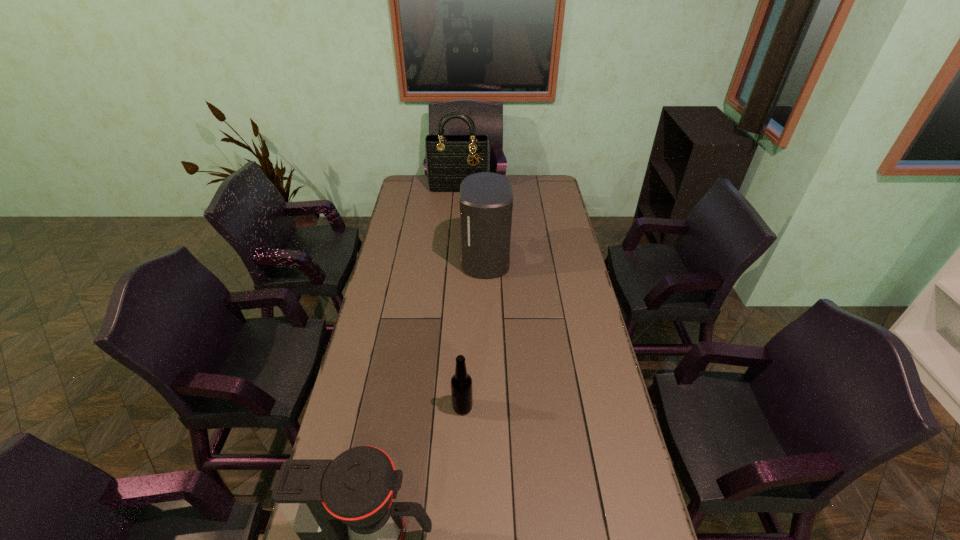
Identify the location of free point between the second farthest object and the beer bottle. The width and height of the screenshot is (960, 540). click(x=473, y=333).

Image resolution: width=960 pixels, height=540 pixels. Find the location of `free space that is in between the shortest object and the right coffee maker`. free space that is in between the shortest object and the right coffee maker is located at coordinates (473, 333).

Select which object is the closest to the second farthest object. Please provide its 2D coordinates. Your answer should be formatted as a tuple, i.e. [(x, y)], where the tuple contains the x and y coordinates of a point satisfying the conditions above.

[(448, 162)]

Locate which object is the third closest to the shortest object. Please provide its 2D coordinates. Your answer should be formatted as a tuple, i.e. [(x, y)], where the tuple contains the x and y coordinates of a point satisfying the conditions above.

[(448, 162)]

The width and height of the screenshot is (960, 540). Find the location of `free space in the image that satisfies the following two spatial constraints: 1. at the front of the farthest object with visible charms; 2. on the left side of the beer bottle`. free space in the image that satisfies the following two spatial constraints: 1. at the front of the farthest object with visible charms; 2. on the left side of the beer bottle is located at coordinates (443, 407).